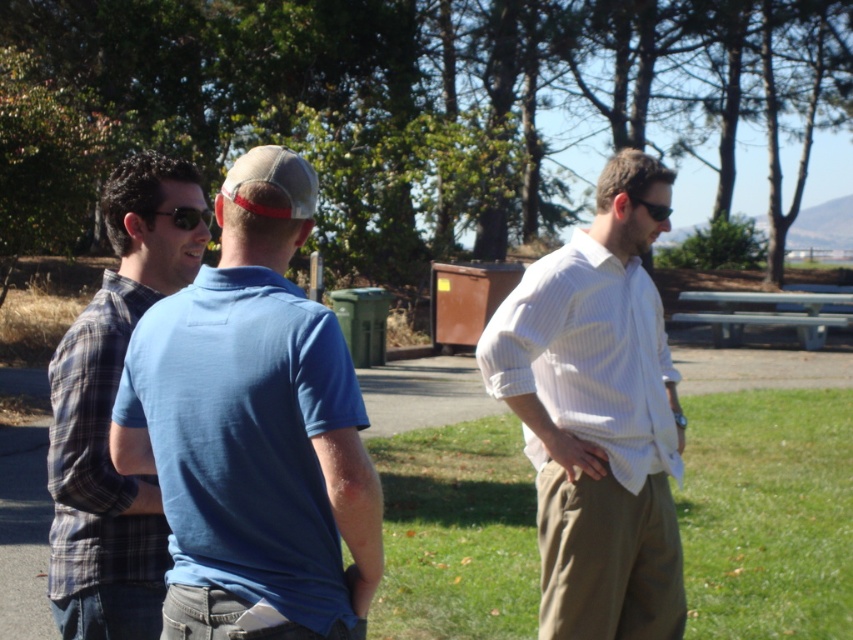
Question: Observing the image, what is the correct spatial positioning of plaid cotton shirt at left in reference to white striped shirt at right?

Choices:
 (A) left
 (B) right

Answer: (A)

Question: Considering the real-world distances, which object is farthest from the black plastic sunglasses at center?

Choices:
 (A) plaid cotton shirt at left
 (B) white striped shirt at right
 (C) matte black sunglasses at center
 (D) blue cotton polo shirt at center

Answer: (D)

Question: Can you confirm if green grass at right is positioned to the right of black plastic sunglasses at center?

Choices:
 (A) no
 (B) yes

Answer: (B)

Question: Which point is closer to the camera?

Choices:
 (A) plaid cotton shirt at left
 (B) blue cotton polo shirt at center
 (C) black plastic sunglasses at center
 (D) matte black sunglasses at center

Answer: (B)

Question: Which point appears farthest from the camera in this image?

Choices:
 (A) 631,202
 (B) 315,632
 (C) 805,579

Answer: (C)

Question: Is plaid cotton shirt at left below black plastic sunglasses at center?

Choices:
 (A) yes
 (B) no

Answer: (A)